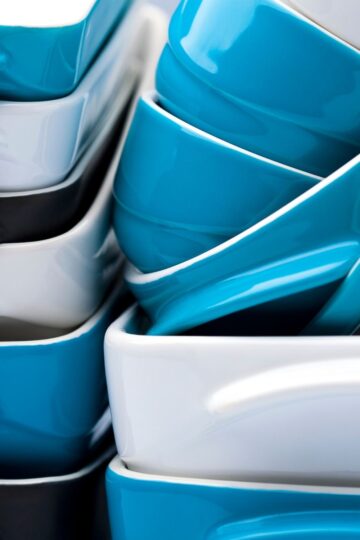
Locate an element on the screen. Image resolution: width=360 pixels, height=540 pixels. bowls that arent blue is located at coordinates click(259, 406), click(41, 501), click(32, 278), click(37, 207), click(33, 131).